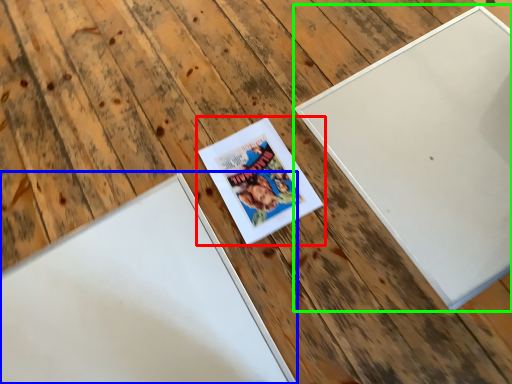
Question: Which is farther away from picture frame (highlighted by a red box)? picture frame (highlighted by a blue box) or picture frame (highlighted by a green box)?

Choices:
 (A) picture frame
 (B) picture frame

Answer: (B)